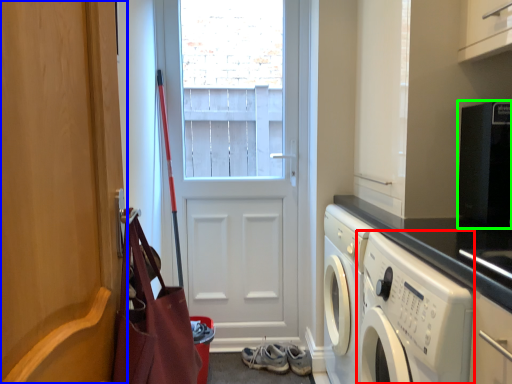
Question: Based on their relative distances, which object is nearer to washing machine (highlighted by a red box)? Choose from door (highlighted by a blue box) and appliance (highlighted by a green box).

Choices:
 (A) door
 (B) appliance

Answer: (B)